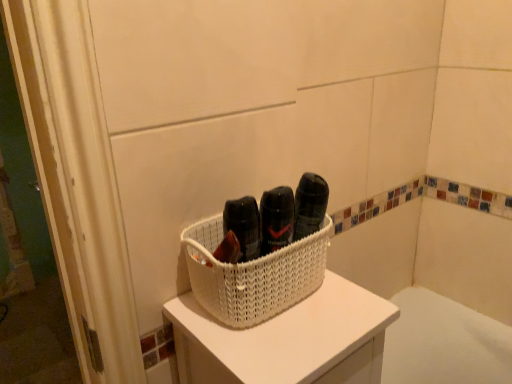
Question: Are white woven basket at center and white woven basket at center located far from each other?

Choices:
 (A) no
 (B) yes

Answer: (A)

Question: Could you tell me if white woven basket at center is facing white woven basket at center?

Choices:
 (A) no
 (B) yes

Answer: (A)

Question: Is white woven basket at center oriented away from white woven basket at center?

Choices:
 (A) yes
 (B) no

Answer: (B)

Question: Is white woven basket at center located outside white woven basket at center?

Choices:
 (A) no
 (B) yes

Answer: (B)

Question: Can you confirm if white woven basket at center is bigger than white woven basket at center?

Choices:
 (A) yes
 (B) no

Answer: (B)

Question: Considering the relative sizes of white woven basket at center and white woven basket at center in the image provided, is white woven basket at center shorter than white woven basket at center?

Choices:
 (A) yes
 (B) no

Answer: (A)

Question: From the image's perspective, is white woven basket at center under white woven basket at center?

Choices:
 (A) yes
 (B) no

Answer: (A)

Question: Does white woven basket at center appear on the right side of white woven basket at center?

Choices:
 (A) yes
 (B) no

Answer: (A)

Question: Is white woven basket at center taller than white woven basket at center?

Choices:
 (A) no
 (B) yes

Answer: (B)

Question: Is white woven basket at center looking in the opposite direction of white woven basket at center?

Choices:
 (A) no
 (B) yes

Answer: (A)

Question: From the image's perspective, is white woven basket at center located above white woven basket at center?

Choices:
 (A) no
 (B) yes

Answer: (A)

Question: Is white woven basket at center further to the viewer compared to white woven basket at center?

Choices:
 (A) yes
 (B) no

Answer: (B)

Question: From the image's perspective, relative to white woven basket at center, is white woven basket at center above or below?

Choices:
 (A) above
 (B) below

Answer: (B)